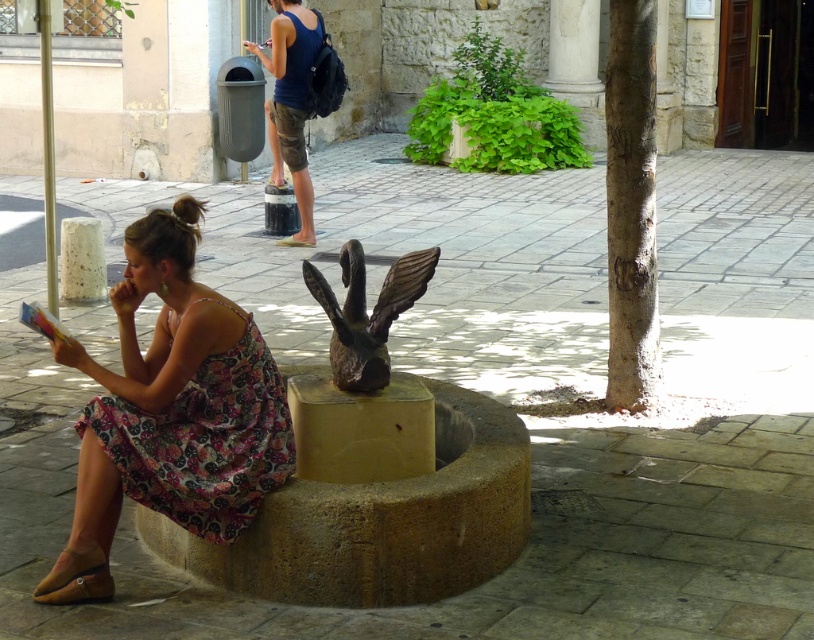
You are standing at the center of the scene and want to find the floral print fabric dress at lower left. According to the coordinates provided, in which direction should you look to locate it?

The floral print fabric dress at lower left is located at point (204, 442), which corresponds to the lower left area of the scene. Since you are at the center, you should look towards the lower left direction to find it.

You are an artist looking to sketch the scene. You notice the bronze statue at center and the matte blue tank top at upper center. Which object is positioned to the right of the other?

The bronze statue at center is to the right of the matte blue tank top at upper center.